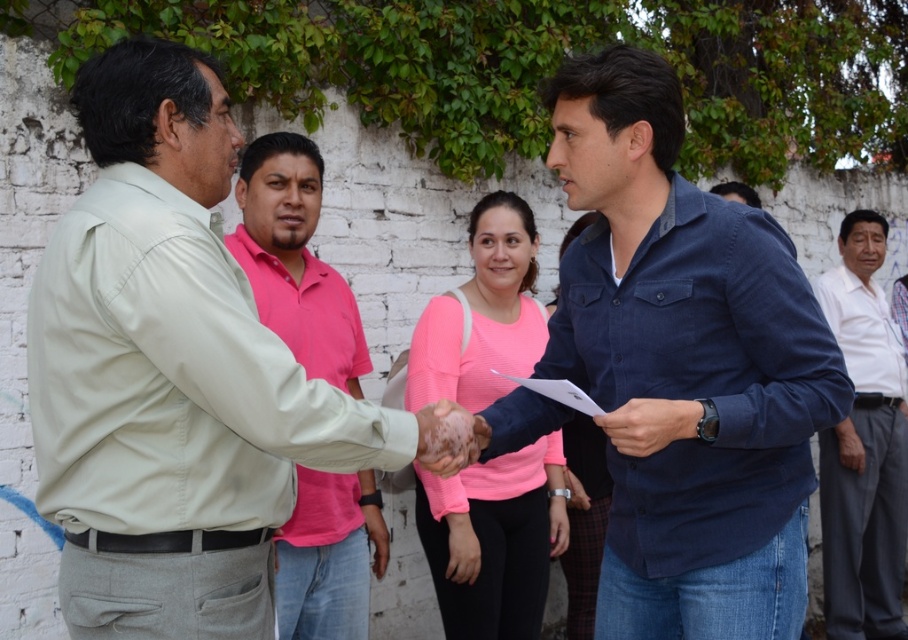
You are a photographer trying to capture the blue denim shirt at center in your shot. Based on the scene description, what are the coordinates where you should focus your camera?

The coordinates to focus on are at point (686, 365) as that is where the blue denim shirt at center is located.

Consider the image. You are a photographer trying to capture a group photo of the two men shaking hands. The blue denim shirt at center and pink matte shirt at center are part of the group. Since you want to ensure everyone is visible, which shirt should you adjust to avoid being hidden by the other?

The blue denim shirt at center is shorter than the pink matte shirt at center, so you should adjust the blue denim shirt at center to avoid being hidden by the taller pink matte shirt at center.

You are a photographer trying to capture a photo of the pink cotton shirt at center and the white cotton shirt at right. Which shirt should you focus on first if you want to ensure both are in the frame without moving the camera?

The pink cotton shirt at center is located above the white cotton shirt at right, so you should focus on the pink cotton shirt at center first to ensure both shirts are within the camera frame.